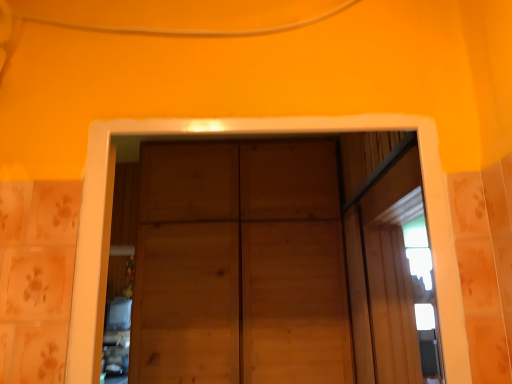
This screenshot has height=384, width=512. What do you see at coordinates (240, 265) in the screenshot?
I see `natural wood door at center` at bounding box center [240, 265].

Locate an element on the screen. The height and width of the screenshot is (384, 512). natural wood door at center is located at coordinates (240, 265).

Where is `transparent glass window at center`? Image resolution: width=512 pixels, height=384 pixels. transparent glass window at center is located at coordinates (385, 259).

What do you see at coordinates (385, 259) in the screenshot? I see `transparent glass window at center` at bounding box center [385, 259].

The width and height of the screenshot is (512, 384). What are the coordinates of `natural wood door at center` in the screenshot? It's located at (240, 265).

Would you say natural wood door at center is to the left or to the right of transparent glass window at center in the picture?

natural wood door at center is positioned on transparent glass window at center's left side.

Which object is further away from the camera, natural wood door at center or transparent glass window at center?

natural wood door at center is further away from the camera.

Which is closer to the camera, (220,188) or (424,224)?

The point (424,224) is more forward.

From the image's perspective, is natural wood door at center located above or below transparent glass window at center?

Clearly, from the image's perspective, natural wood door at center is below transparent glass window at center.

From a real-world perspective, which is physically below, natural wood door at center or transparent glass window at center?

transparent glass window at center, from a real-world perspective.

Which of these two, natural wood door at center or transparent glass window at center, is wider?

Wider between the two is natural wood door at center.

Can you confirm if natural wood door at center is taller than transparent glass window at center?

Indeed, natural wood door at center has a greater height compared to transparent glass window at center.

In terms of size, does natural wood door at center appear bigger or smaller than transparent glass window at center?

In the image, natural wood door at center appears to be larger than transparent glass window at center.

Is natural wood door at center inside or outside of transparent glass window at center?

natural wood door at center lies outside transparent glass window at center.

Is natural wood door at center in contact with transparent glass window at center?

No, natural wood door at center is not beside transparent glass window at center.

Is natural wood door at center looking in the opposite direction of transparent glass window at center?

No, natural wood door at center is not facing away from transparent glass window at center.

How distant is natural wood door at center from transparent glass window at center?

The distance of natural wood door at center from transparent glass window at center is 51.83 centimeters.

The width and height of the screenshot is (512, 384). Find the location of `window in front of the natural wood door at center`. window in front of the natural wood door at center is located at coordinates (385, 259).

Would you say transparent glass window at center is to the left or to the right of natural wood door at center in the picture?

Clearly, transparent glass window at center is on the right of natural wood door at center in the image.

Which object is closer to the camera, transparent glass window at center or natural wood door at center?

transparent glass window at center is in front.

Considering the positions of point (412, 175) and point (223, 242), is point (412, 175) closer or farther from the camera than point (223, 242)?

Point (412, 175) is closer to the camera than point (223, 242).

From the image's perspective, which one is positioned lower, transparent glass window at center or natural wood door at center?

From the image's view, natural wood door at center is below.

From a real-world perspective, which object stands above the other?

natural wood door at center is physically above.

Is transparent glass window at center wider or thinner than natural wood door at center?

Clearly, transparent glass window at center has less width compared to natural wood door at center.

Considering the sizes of objects transparent glass window at center and natural wood door at center in the image provided, who is shorter, transparent glass window at center or natural wood door at center?

transparent glass window at center is shorter.

Considering the sizes of objects transparent glass window at center and natural wood door at center in the image provided, who is bigger, transparent glass window at center or natural wood door at center?

natural wood door at center.

Is transparent glass window at center inside or outside of natural wood door at center?

transparent glass window at center is located beyond the bounds of natural wood door at center.

Looking at this image, is transparent glass window at center with natural wood door at center?

There is a gap between transparent glass window at center and natural wood door at center.

Is transparent glass window at center oriented away from natural wood door at center?

No, transparent glass window at center is not facing away from natural wood door at center.

What's the angular difference between transparent glass window at center and natural wood door at center's facing directions?

transparent glass window at center and natural wood door at center are facing 90.4 degrees away from each other.

The width and height of the screenshot is (512, 384). I want to click on window that is above the natural wood door at center (from the image's perspective), so click(385, 259).

This screenshot has width=512, height=384. I want to click on window above the natural wood door at center (from the image's perspective), so click(x=385, y=259).

The image size is (512, 384). Identify the location of door located on the left of transparent glass window at center. click(x=240, y=265).